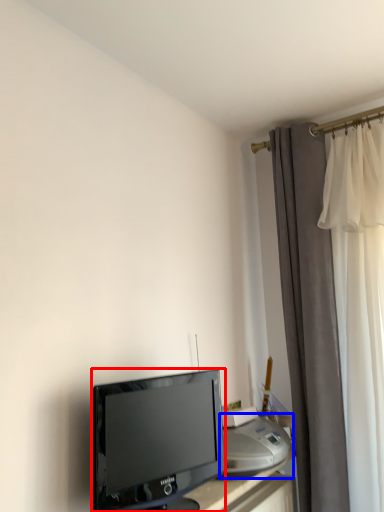
Question: Which object is further to the camera taking this photo, television (highlighted by a red box) or printer (highlighted by a blue box)?

Choices:
 (A) television
 (B) printer

Answer: (B)